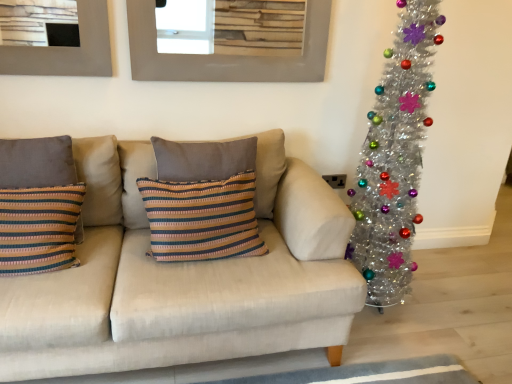
Question: Is shiny silver christmas tree at right to the left of beige fabric couch at center from the viewer's perspective?

Choices:
 (A) no
 (B) yes

Answer: (A)

Question: Considering the relative sizes of shiny silver christmas tree at right and beige fabric couch at center in the image provided, is shiny silver christmas tree at right shorter than beige fabric couch at center?

Choices:
 (A) yes
 (B) no

Answer: (B)

Question: Can you confirm if shiny silver christmas tree at right is thinner than beige fabric couch at center?

Choices:
 (A) yes
 (B) no

Answer: (A)

Question: From the image's perspective, is shiny silver christmas tree at right over beige fabric couch at center?

Choices:
 (A) no
 (B) yes

Answer: (B)

Question: Does shiny silver christmas tree at right contain beige fabric couch at center?

Choices:
 (A) yes
 (B) no

Answer: (B)

Question: From a real-world perspective, is shiny silver christmas tree at right positioned above or below striped fabric cushion at center, placed as the 2th pillow when sorted from left to right?

Choices:
 (A) above
 (B) below

Answer: (A)

Question: Is point (387, 155) closer or farther from the camera than point (141, 162)?

Choices:
 (A) closer
 (B) farther

Answer: (A)

Question: Is shiny silver christmas tree at right spatially inside striped fabric cushion at center, placed as the 1th pillow when sorted from right to left, or outside of it?

Choices:
 (A) outside
 (B) inside

Answer: (A)

Question: Is shiny silver christmas tree at right in front of or behind striped fabric cushion at center, placed as the 2th pillow when sorted from left to right, in the image?

Choices:
 (A) front
 (B) behind

Answer: (A)

Question: From a real-world perspective, is striped fabric cushion at left, arranged as the first pillow when viewed from the left, above or below striped fabric cushion at center, placed as the 2th pillow when sorted from left to right?

Choices:
 (A) above
 (B) below

Answer: (B)

Question: Is striped fabric cushion at left, arranged as the first pillow when viewed from the left, situated inside striped fabric cushion at center, placed as the 1th pillow when sorted from right to left, or outside?

Choices:
 (A) inside
 (B) outside

Answer: (B)

Question: In terms of width, does striped fabric cushion at left, the 2th pillow when ordered from right to left, look wider or thinner when compared to striped fabric cushion at center, placed as the 1th pillow when sorted from right to left?

Choices:
 (A) thin
 (B) wide

Answer: (A)

Question: Considering their positions, is striped fabric cushion at left, arranged as the first pillow when viewed from the left, located in front of or behind striped fabric cushion at center, placed as the 2th pillow when sorted from left to right?

Choices:
 (A) behind
 (B) front

Answer: (B)

Question: Is striped fabric cushion at center, placed as the 2th pillow when sorted from left to right, wider or thinner than shiny silver christmas tree at right?

Choices:
 (A) wide
 (B) thin

Answer: (B)

Question: Is striped fabric cushion at center, placed as the 1th pillow when sorted from right to left, taller or shorter than shiny silver christmas tree at right?

Choices:
 (A) tall
 (B) short

Answer: (B)